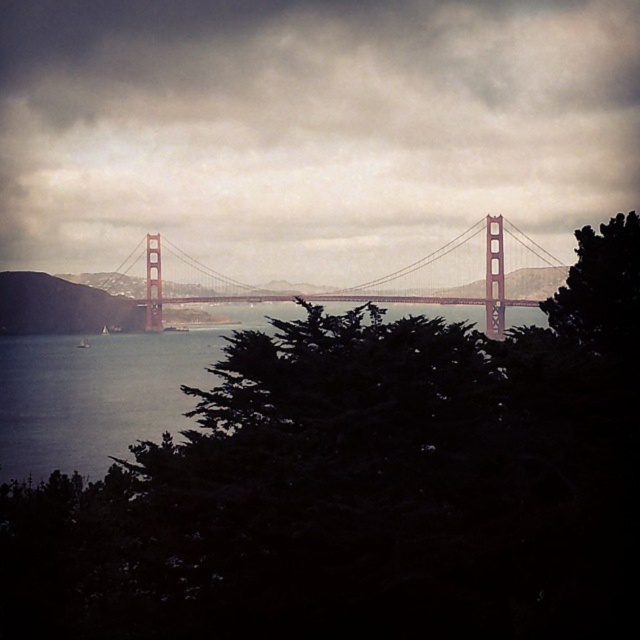
Question: Which of the following is the closest to the observer?

Choices:
 (A) pyautogui.click(x=556, y=13)
 (B) pyautogui.click(x=305, y=541)

Answer: (B)

Question: Which object is the farthest from the metallic red bridge at center?

Choices:
 (A) green leafy tree at center
 (B) cloudy sky at center

Answer: (A)

Question: Is the position of green leafy tree at center less distant than that of cloudy sky at center?

Choices:
 (A) no
 (B) yes

Answer: (B)

Question: Is the position of green leafy tree at center less distant than that of cloudy sky at center?

Choices:
 (A) yes
 (B) no

Answer: (A)

Question: Which of the following is the closest to the observer?

Choices:
 (A) (401, 384)
 (B) (54, 189)

Answer: (A)

Question: Can you confirm if green leafy tree at center is positioned below cloudy sky at center?

Choices:
 (A) no
 (B) yes

Answer: (B)